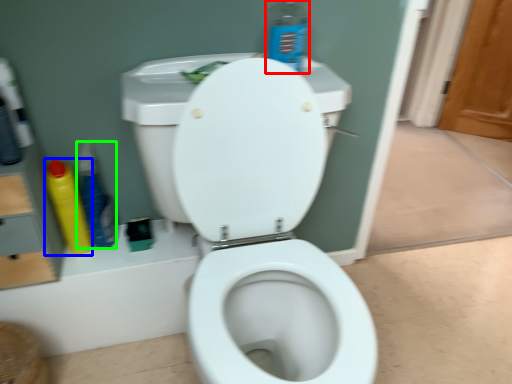
Question: Considering the real-world distances, which object is farthest from cleaning product (highlighted by a red box)? cleaning product (highlighted by a blue box) or cleaning product (highlighted by a green box)?

Choices:
 (A) cleaning product
 (B) cleaning product

Answer: (A)